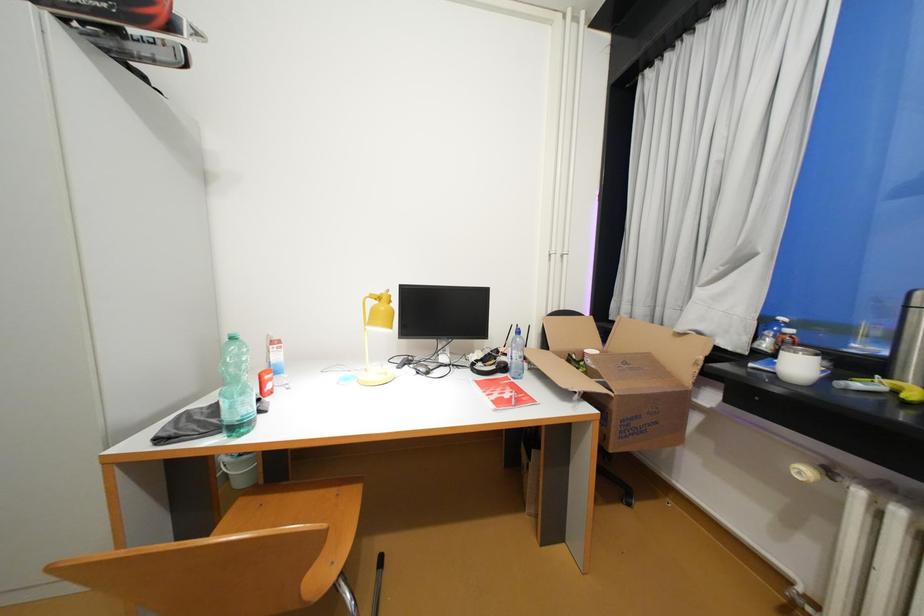
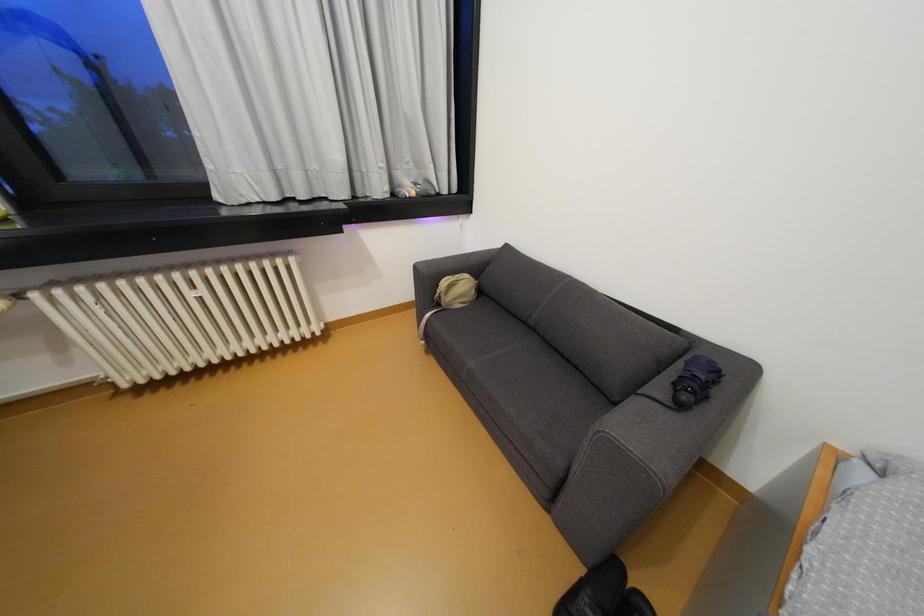
Based on the continuous images, in which direction is the camera rotating?

The rotation direction of the camera is right-down.